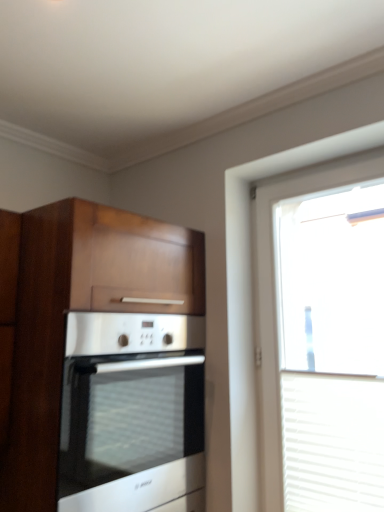
Where is `wooden cabinet at left`? This screenshot has height=512, width=384. wooden cabinet at left is located at coordinates (106, 362).

Describe the element at coordinates (132, 412) in the screenshot. I see `satin silver oven at center` at that location.

In order to face satin silver oven at center, should I rotate leftwards or rightwards?

To align with it, rotate left about 12.787°.

The image size is (384, 512). I want to click on transparent glass window at right, so click(x=275, y=302).

Considering the sizes of objects satin silver oven at center and white plastic blinds at right in the image provided, who is bigger, satin silver oven at center or white plastic blinds at right?

With larger size is satin silver oven at center.

Is satin silver oven at center spatially inside white plastic blinds at right, or outside of it?

satin silver oven at center exists outside the volume of white plastic blinds at right.

Is satin silver oven at center far away from white plastic blinds at right?

No, there isn't a large distance between satin silver oven at center and white plastic blinds at right.

Can you tell me how much satin silver oven at center and wooden cabinet at left differ in facing direction?

0.000415 degrees.

Looking at this image, does satin silver oven at center have a greater height compared to wooden cabinet at left?

No, satin silver oven at center is not taller than wooden cabinet at left.

Between satin silver oven at center and wooden cabinet at left, which one appears on the left side from the viewer's perspective?

Positioned to the left is wooden cabinet at left.

Is satin silver oven at center wider or thinner than wooden cabinet at left?

satin silver oven at center is wider than wooden cabinet at left.

Considering the relative positions of wooden cabinet at left and white plastic blinds at right in the image provided, is wooden cabinet at left in front of white plastic blinds at right?

Yes.

From the image's perspective, between wooden cabinet at left and white plastic blinds at right, which one is located above?

wooden cabinet at left appears higher in the image.

In the scene shown: Is wooden cabinet at left at the right side of white plastic blinds at right?

No, wooden cabinet at left is not to the right of white plastic blinds at right.

Is transparent glass window at right far from satin silver oven at center?

No, transparent glass window at right is not far from satin silver oven at center.

Would you say transparent glass window at right contains satin silver oven at center?

No, satin silver oven at center is not a part of transparent glass window at right.

Between transparent glass window at right and satin silver oven at center, which one has smaller size?

transparent glass window at right.

Consider the image. Who is more distant, transparent glass window at right or satin silver oven at center?

Positioned behind is transparent glass window at right.

From the image's perspective, relative to transparent glass window at right, is wooden cabinet at left above or below?

wooden cabinet at left is situated lower than transparent glass window at right in the image.

Identify the location of cabinetry below the transparent glass window at right (from the image's perspective). The image size is (384, 512). (106, 362).

Between point (94, 268) and point (383, 166), which one is positioned behind?

The point (383, 166) is behind.

Is transparent glass window at right turned away from wooden cabinet at left?

That's not correct — transparent glass window at right is not looking away from wooden cabinet at left.

Find the location of a particular element. Image resolution: width=384 pixels, height=512 pixels. cabinetry in front of the transparent glass window at right is located at coordinates (106, 362).

Visually, is transparent glass window at right positioned to the left or to the right of wooden cabinet at left?

Based on their positions, transparent glass window at right is located to the right of wooden cabinet at left.

Can you confirm if transparent glass window at right is wider than wooden cabinet at left?

In fact, transparent glass window at right might be narrower than wooden cabinet at left.

In order to click on window that appears in front of the white plastic blinds at right in this screenshot , I will do `click(275, 302)`.

Is white plastic blinds at right surrounded by transparent glass window at right?

That's correct, white plastic blinds at right is inside transparent glass window at right.

Does transparent glass window at right turn towards white plastic blinds at right?

Yes.

From a real-world perspective, is transparent glass window at right physically above white plastic blinds at right?

Yes, from a real-world perspective, transparent glass window at right is on top of white plastic blinds at right.

I want to click on blind on the right side of satin silver oven at center, so click(332, 442).

The image size is (384, 512). In order to click on cabinetry located above the satin silver oven at center (from a real-world perspective) in this screenshot , I will do `click(106, 362)`.

Estimate the real-world distances between objects in this image. Which object is further from wooden cabinet at left, transparent glass window at right or white plastic blinds at right?

white plastic blinds at right is further to wooden cabinet at left.

Considering their positions, is white plastic blinds at right positioned further to wooden cabinet at left than satin silver oven at center?

white plastic blinds at right lies further to wooden cabinet at left than the other object.

Estimate the real-world distances between objects in this image. Which object is closer to satin silver oven at center, transparent glass window at right or wooden cabinet at left?

wooden cabinet at left.

Considering their positions, is transparent glass window at right positioned further to wooden cabinet at left than satin silver oven at center?

transparent glass window at right.

When comparing their distances from white plastic blinds at right, does wooden cabinet at left or transparent glass window at right seem closer?

Based on the image, transparent glass window at right appears to be nearer to white plastic blinds at right.

Considering their positions, is white plastic blinds at right positioned further to satin silver oven at center than transparent glass window at right?

white plastic blinds at right.

From the picture: From the image, which object appears to be nearer to white plastic blinds at right, satin silver oven at center or transparent glass window at right?

Based on the image, transparent glass window at right appears to be nearer to white plastic blinds at right.

When comparing their distances from wooden cabinet at left, does satin silver oven at center or white plastic blinds at right seem closer?

Among the two, satin silver oven at center is located nearer to wooden cabinet at left.

This screenshot has height=512, width=384. In order to click on oven located between wooden cabinet at left and transparent glass window at right in the left-right direction in this screenshot , I will do `click(132, 412)`.

Find the location of a particular element. Image resolution: width=384 pixels, height=512 pixels. blind located between wooden cabinet at left and transparent glass window at right in the left-right direction is located at coordinates (332, 442).

Where is `blind located between satin silver oven at center and transparent glass window at right in the left-right direction`? blind located between satin silver oven at center and transparent glass window at right in the left-right direction is located at coordinates (332, 442).

Identify the location of oven between wooden cabinet at left and white plastic blinds at right from left to right. (132, 412).